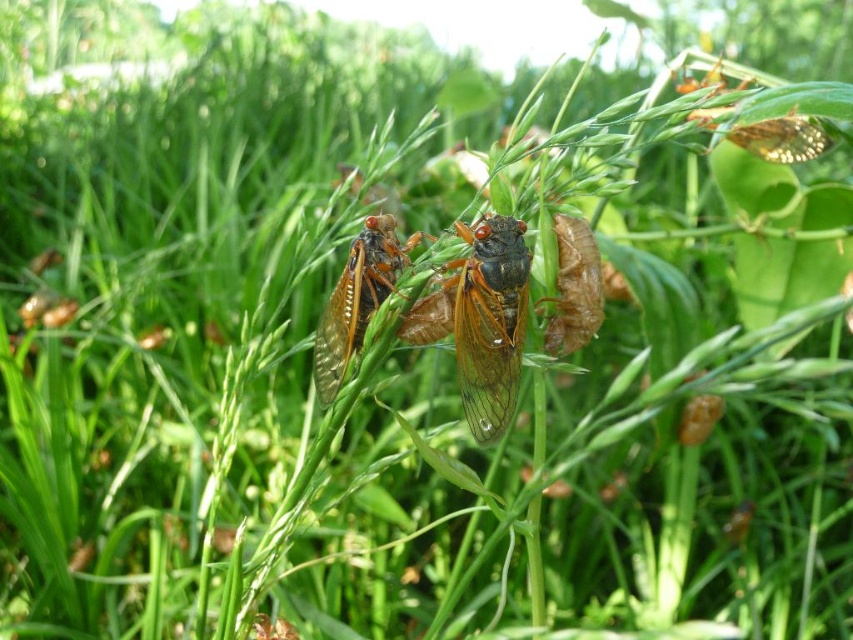
Question: In this image, where is translucent amber wings at center located relative to translucent brown cicada at center?

Choices:
 (A) left
 (B) right

Answer: (B)

Question: Which of the following is the farthest from the observer?

Choices:
 (A) (520, 280)
 (B) (392, 285)

Answer: (B)

Question: Is translucent amber wings at center bigger than translucent brown cicada at center?

Choices:
 (A) yes
 (B) no

Answer: (B)

Question: Can you confirm if translucent amber wings at center is smaller than translucent brown cicada at center?

Choices:
 (A) no
 (B) yes

Answer: (B)